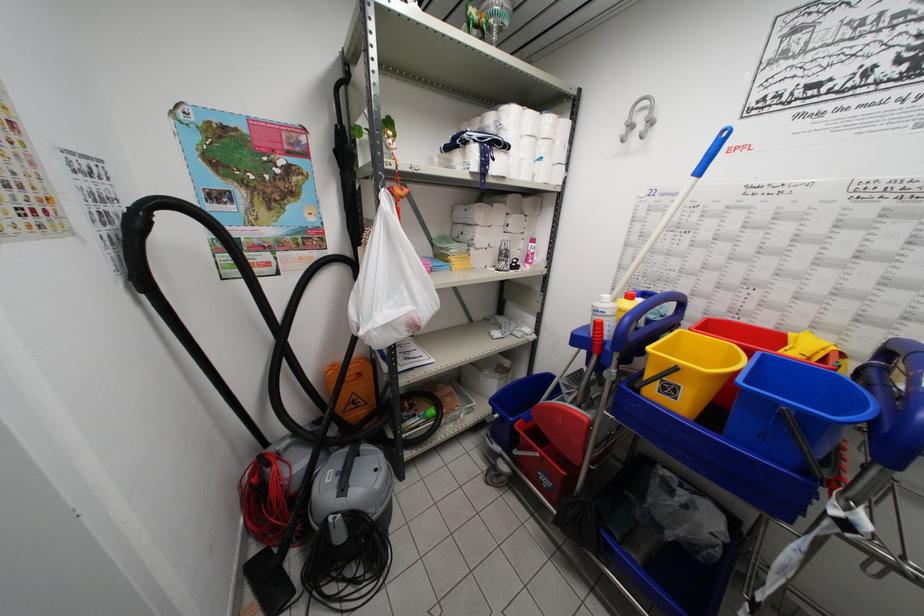
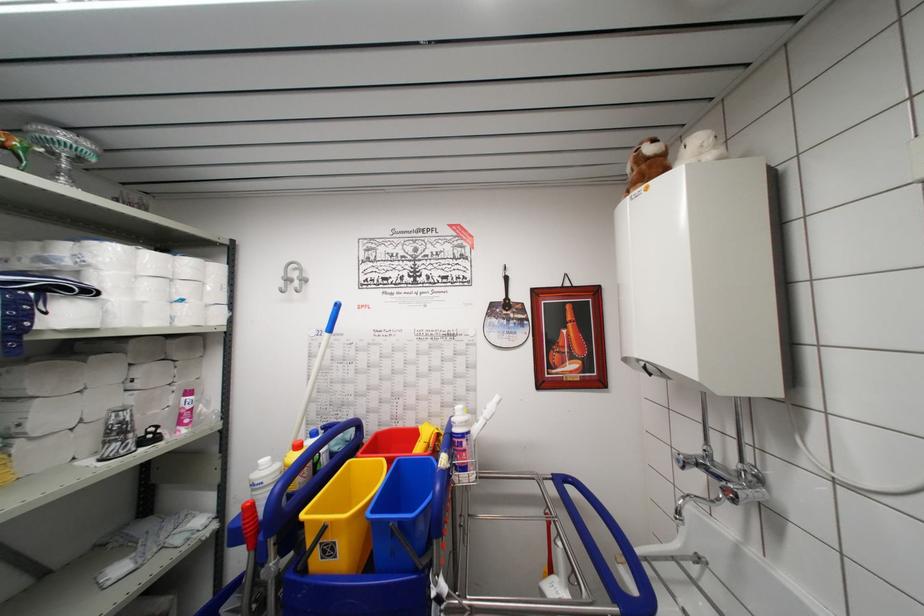
Where in the second image is the point corresponding to point 545,153 from the first image?

(188, 294)